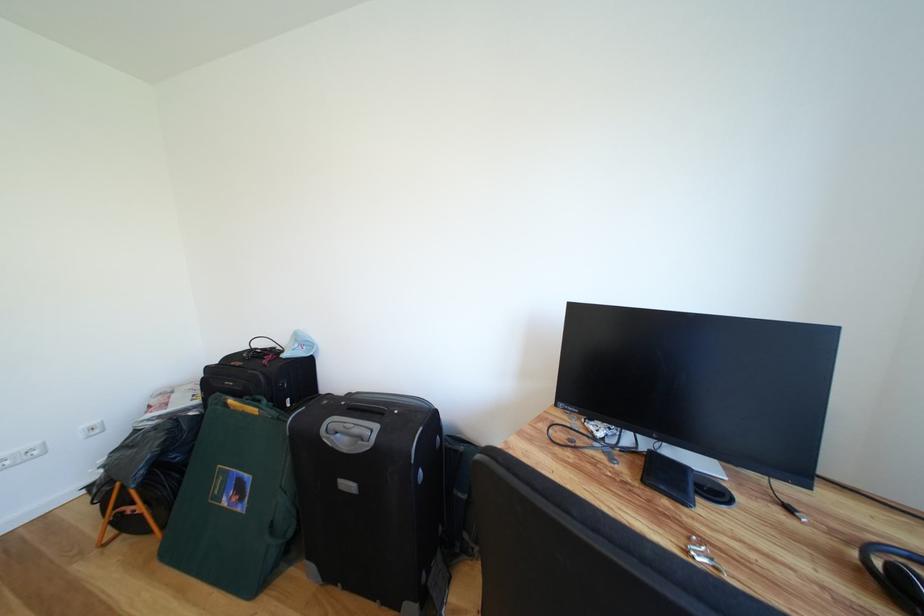
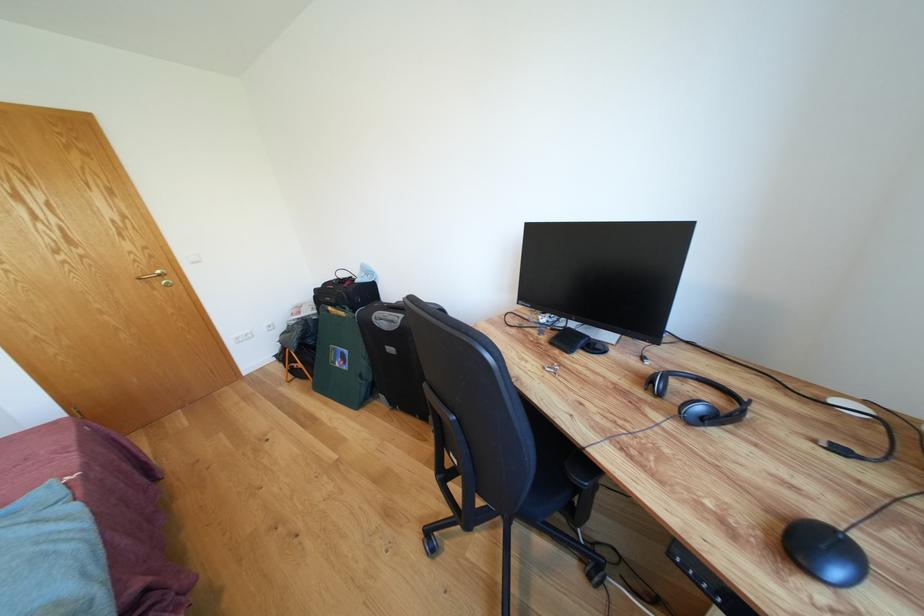
Locate, in the second image, the point that corresponds to pixel 365 436 in the first image.

(398, 322)